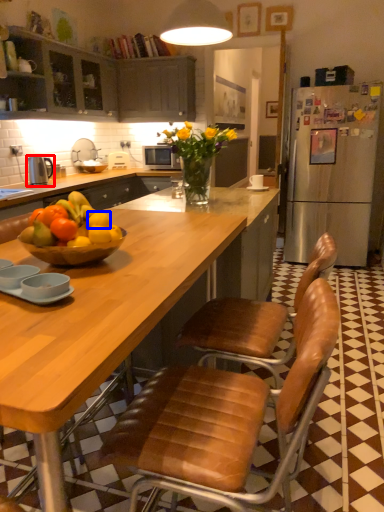
Question: Which object is closer to the camera taking this photo, kitchen appliance (highlighted by a red box) or orange (highlighted by a blue box)?

Choices:
 (A) kitchen appliance
 (B) orange

Answer: (B)